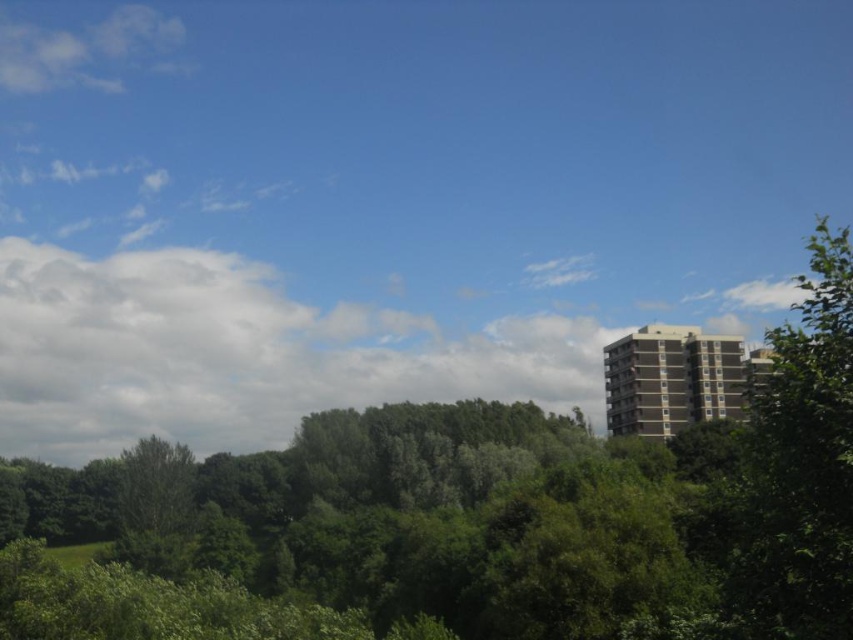
You are standing in the serene outdoor scene and want to take a photo of the green leafy tree at upper center and the white fluffy cloud at upper left. Which object is positioned lower in the frame?

The green leafy tree at upper center is located below the white fluffy cloud at upper left, so it is positioned lower in the frame.

You are standing in the serene outdoor scene and want to walk from the point closer to you to the point further away. Which path would you take between the two points, point [310,433] and point [10,92]?

The path from point [310,433] to point [10,92] would involve moving towards the background since point [310,433] is closer to the viewer and point [10,92] is further away.

You are planning to take a photo of the white fluffy cloud at upper left and the green leafy tree at right. Which object should you zoom in more on to capture its full size in the frame?

You should zoom in more on the green leafy tree at right because its width is larger than the white fluffy cloud at upper left.